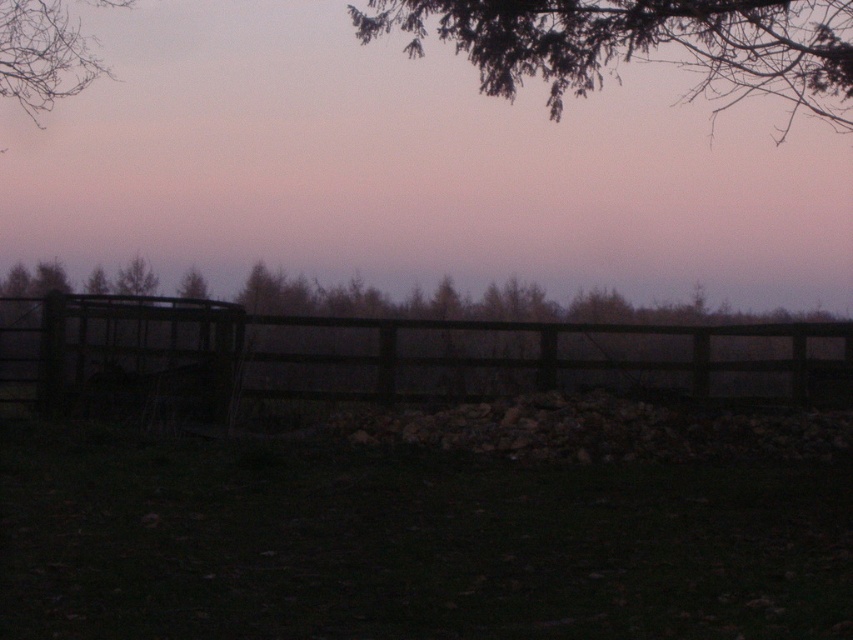
Question: Can you confirm if matte wooden fence at center is wider than dark brown wooden fence at center?

Choices:
 (A) yes
 (B) no

Answer: (A)

Question: Among these points, which one is nearest to the camera?

Choices:
 (A) (456, 42)
 (B) (204, 116)
 (C) (9, 72)

Answer: (C)

Question: Which object is closer to the camera taking this photo?

Choices:
 (A) matte wooden fence at center
 (B) bare branches at upper left
 (C) dark brown wooden fence at center
 (D) green leafy branch at upper center

Answer: (D)

Question: Is green leafy branch at upper center thinner than bare branches at upper left?

Choices:
 (A) no
 (B) yes

Answer: (A)

Question: Which object appears closest to the camera in this image?

Choices:
 (A) green leafy branch at upper center
 (B) matte wooden fence at center
 (C) bare branches at upper left

Answer: (A)

Question: Where is matte wooden fence at center located in relation to bare branches at upper left in the image?

Choices:
 (A) below
 (B) above

Answer: (A)